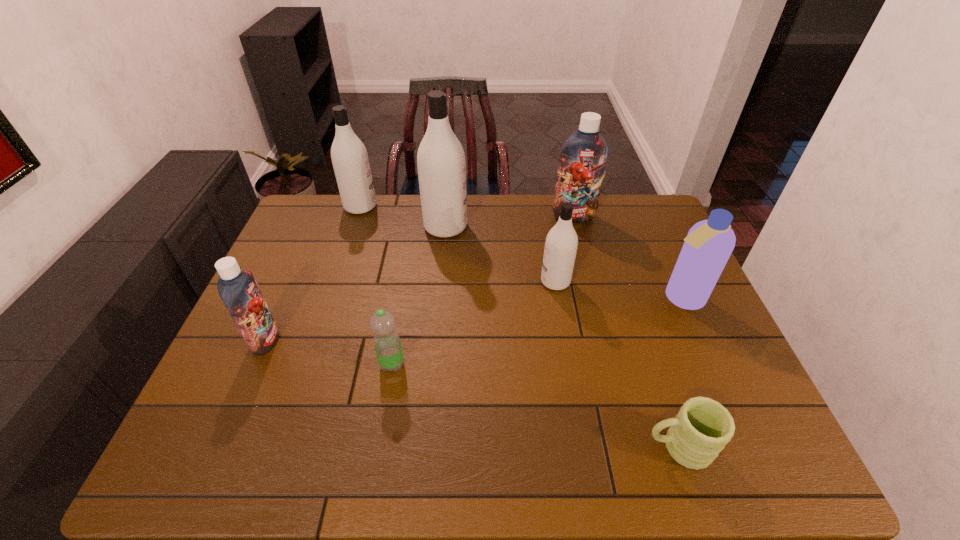
Choose which shampoo is the third nearest neighbor to the biggest white shampoo. Please provide its 2D coordinates. Your answer should be formatted as a tuple, i.e. [(x, y)], where the tuple contains the x and y coordinates of a point satisfying the conditions above.

[(583, 156)]

At what (x,y) coordinates should I click in order to perform the action: click on white shampoo object that ranks as the second closest to the smallest white shampoo. Please return your answer as a coordinate pair (x, y). This screenshot has width=960, height=540. Looking at the image, I should click on (349, 156).

Identify the location of the third closest white shampoo to the second shortest object. This screenshot has height=540, width=960. (349, 156).

Identify the location of vacant space that satisfies the following two spatial constraints: 1. on the front side of the rightmost object; 2. on the front label of the leftmost shampoo. The height and width of the screenshot is (540, 960). (699, 340).

At what (x,y) coordinates should I click in order to perform the action: click on free region that satisfies the following two spatial constraints: 1. on the front label of the right blue shampoo; 2. on the front-facing side of the nearest white shampoo. Please return your answer as a coordinate pair (x, y). Image resolution: width=960 pixels, height=540 pixels. Looking at the image, I should click on (590, 281).

Where is `blank area in the image that satisfies the following two spatial constraints: 1. on the front-facing side of the tallest shampoo; 2. on the right side of the rightmost object`? blank area in the image that satisfies the following two spatial constraints: 1. on the front-facing side of the tallest shampoo; 2. on the right side of the rightmost object is located at coordinates (440, 298).